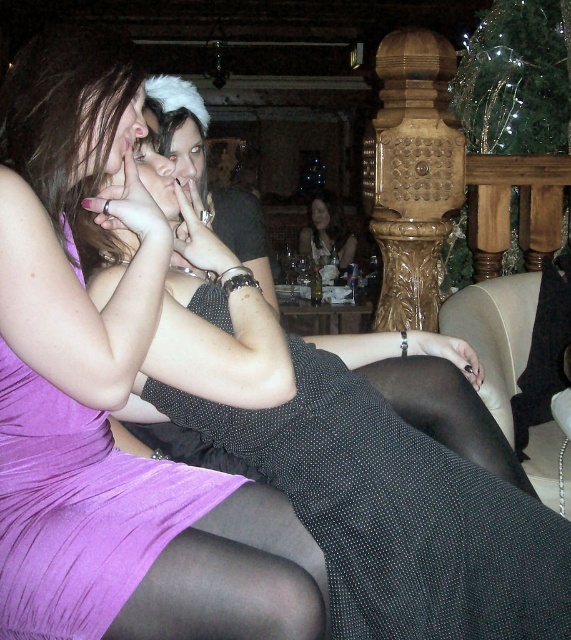
Is point (420, 436) farther from viewer compared to point (5, 616)?

Yes, point (420, 436) is farther from viewer.

Does black textured dress at center lie behind purple pleated dress at center?

Yes.

Does point (215, 292) come in front of point (27, 397)?

That is False.

The image size is (571, 640). Find the location of `black textured dress at center`. black textured dress at center is located at coordinates (396, 513).

Between purple pleated dress at center and matte black dress at center, which one has more height?

Standing taller between the two is matte black dress at center.

Is point (29, 371) positioned before point (311, 234)?

Yes, it is in front of point (311, 234).

Image resolution: width=571 pixels, height=640 pixels. What are the coordinates of `purple pleated dress at center` in the screenshot? It's located at (79, 509).

How far apart are black textured dress at center and matte black dress at center?

black textured dress at center is 4.68 meters away from matte black dress at center.

Can you confirm if black textured dress at center is shorter than matte black dress at center?

Yes.

Find the location of a particular element. This screenshot has width=571, height=640. black textured dress at center is located at coordinates (396, 513).